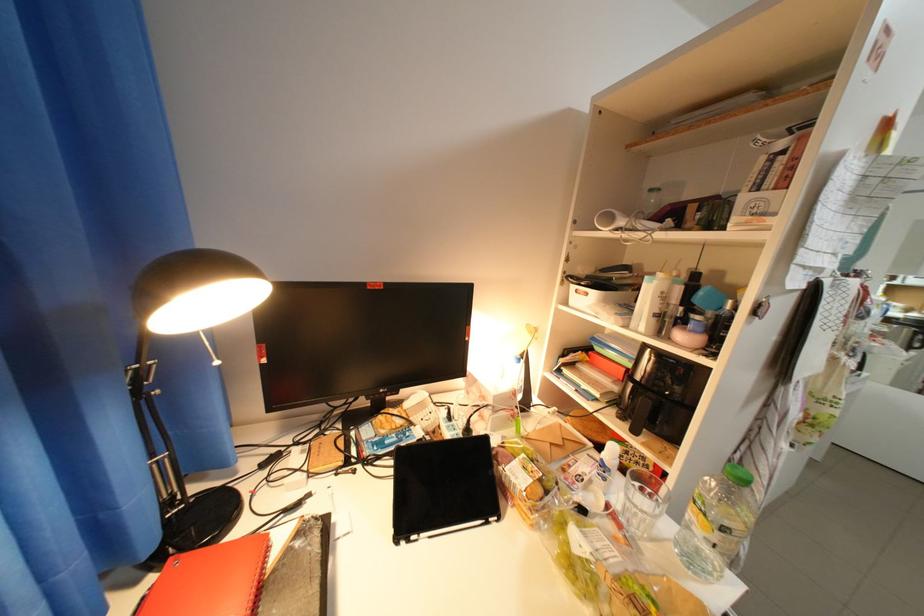
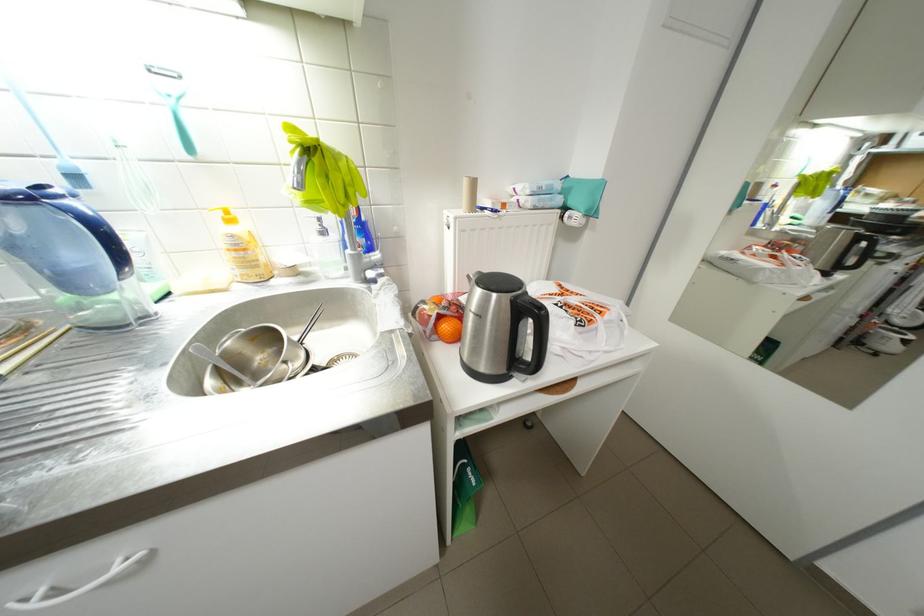
Looking at this image, in a continuous first-person perspective shot, in which direction is the camera moving?

The cameraman moved toward right, forward.